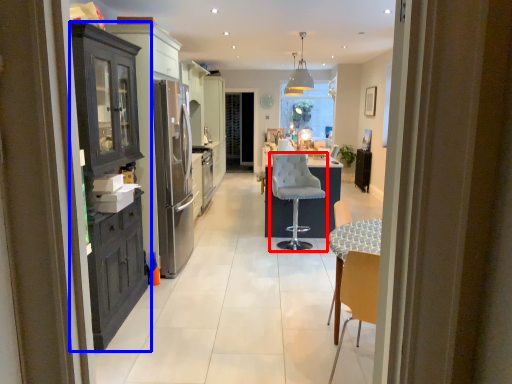
Question: Which object appears closest to the camera in this image, chair (highlighted by a red box) or cabinetry (highlighted by a blue box)?

Choices:
 (A) chair
 (B) cabinetry

Answer: (B)